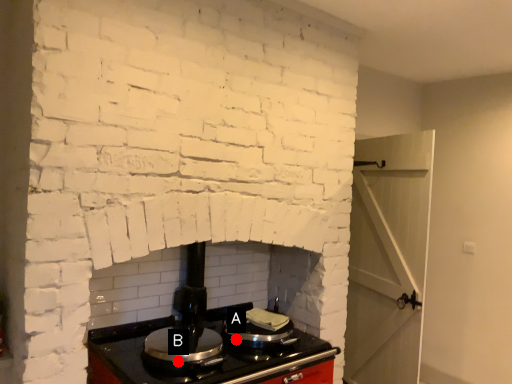
Question: Two points are circled on the image, labeled by A and B beside each circle. Which of the following is the farthest from the observer?

Choices:
 (A) A is further
 (B) B is further

Answer: (A)